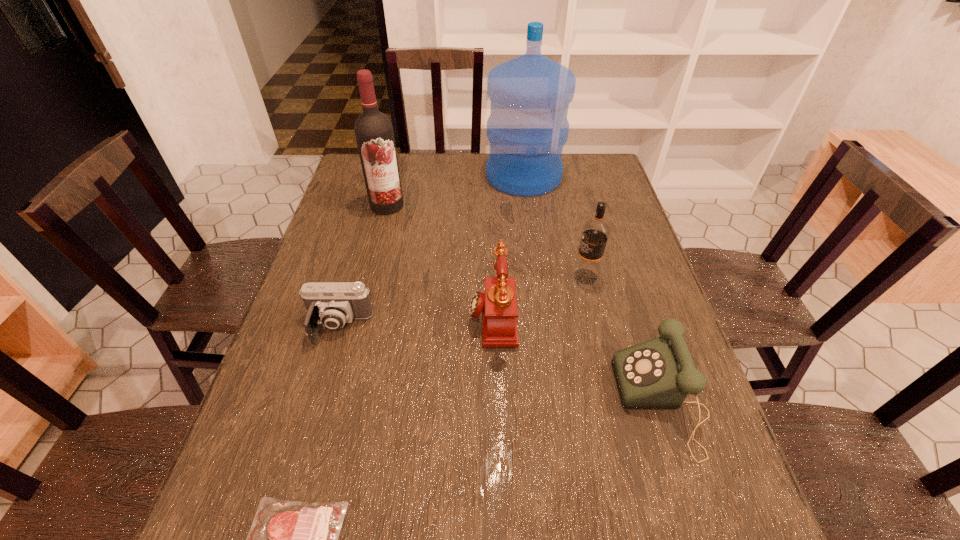
This screenshot has height=540, width=960. Identify the location of water jug. (527, 128).

At what (x,y) coordinates should I click in order to perform the action: click on the sixth shortest object. Please return your answer as a coordinate pair (x, y). Image resolution: width=960 pixels, height=540 pixels. Looking at the image, I should click on (374, 134).

This screenshot has height=540, width=960. I want to click on the third tallest object, so click(x=595, y=232).

Find the location of a particular element. This screenshot has height=540, width=960. the left telephone is located at coordinates (498, 304).

The height and width of the screenshot is (540, 960). In order to click on the fourth shortest object in this screenshot , I will do `click(498, 304)`.

Locate an element on the screen. This screenshot has width=960, height=540. the right telephone is located at coordinates (657, 374).

I want to click on the fifth tallest object, so click(x=657, y=374).

The height and width of the screenshot is (540, 960). What are the coordinates of `the sixth tallest object` in the screenshot? It's located at (333, 304).

The width and height of the screenshot is (960, 540). I want to click on vacant space located on the front of the water jug, so click(x=535, y=258).

The width and height of the screenshot is (960, 540). I want to click on vacant space located on the label of the second tallest object, so click(x=369, y=280).